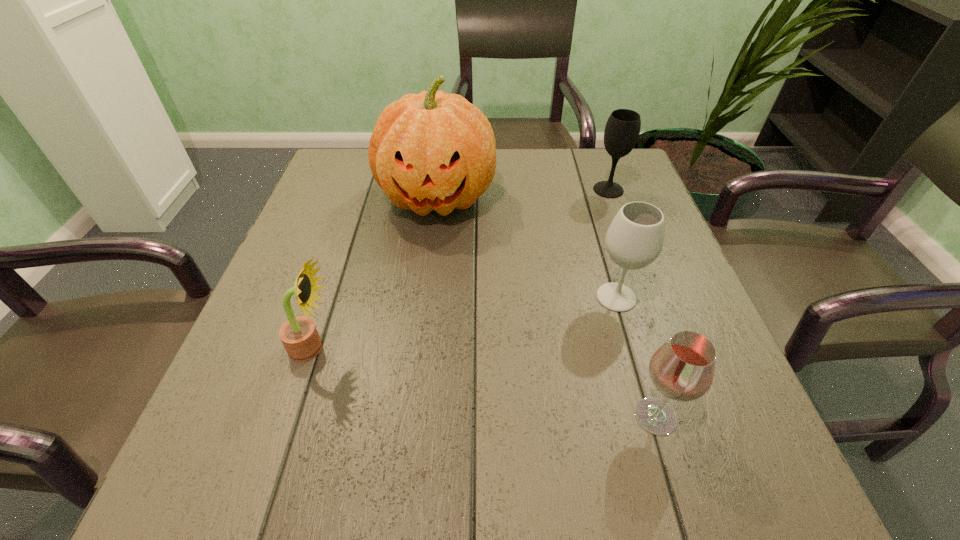
You are a GUI agent. You are given a task and a screenshot of the screen. Output one action in this format:
    pyautogui.click(x=<x>, y=<y>)
    Task: Click on the pumpkin
    The width and height of the screenshot is (960, 540).
    Given the screenshot: What is the action you would take?
    pyautogui.click(x=430, y=151)

Identify the location of the tallest object. (430, 151).

Find the location of `the second farthest wineglass`. the second farthest wineglass is located at coordinates (635, 238).

Identify the location of the farthest wineglass. The height and width of the screenshot is (540, 960). (622, 129).

Locate an element on the screen. The image size is (960, 540). the second nearest object is located at coordinates (299, 336).

The height and width of the screenshot is (540, 960). Identify the location of the leftmost object. (299, 336).

Locate an element on the screen. The height and width of the screenshot is (540, 960). the nearest wineglass is located at coordinates click(682, 369).

Where is `free space located on the carved face of the fourth object from right to left`? free space located on the carved face of the fourth object from right to left is located at coordinates (428, 276).

Identify the location of vacant space located 0.220m on the left of the second farthest wineglass. (478, 297).

Find the location of a particular element. free space located on the left of the farthest wineglass is located at coordinates (442, 190).